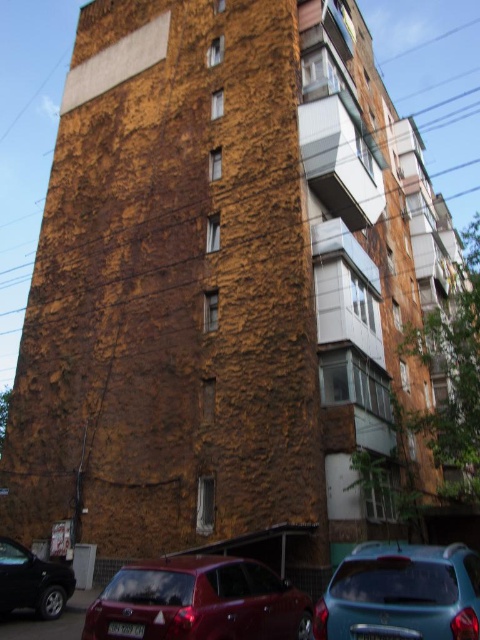
Does shiny red sedan at lower center appear over shiny black car at lower left?

Correct, shiny red sedan at lower center is located above shiny black car at lower left.

Does shiny red sedan at lower center appear under shiny black car at lower left?

Incorrect, shiny red sedan at lower center is not positioned below shiny black car at lower left.

Does point (227, 563) lie behind point (58, 573)?

That is False.

Find the location of `shiny red sedan at lower center`. shiny red sedan at lower center is located at coordinates (199, 602).

Is teal matte car at lower right smaller than shiny black car at lower left?

Correct, teal matte car at lower right occupies less space than shiny black car at lower left.

Does teal matte car at lower right appear on the left side of shiny black car at lower left?

In fact, teal matte car at lower right is to the right of shiny black car at lower left.

Identify the location of teal matte car at lower right. (402, 593).

You are a GUI agent. You are given a task and a screenshot of the screen. Output one action in this format:
    pyautogui.click(x=<x>, y=<y>)
    Task: Click on the teal matte car at lower right
    
    Given the screenshot: What is the action you would take?
    [402, 593]

Does shiny red sedan at lower center have a lesser width compared to teal matte car at lower right?

No, shiny red sedan at lower center is not thinner than teal matte car at lower right.

Is shiny red sedan at lower center wider than teal matte car at lower right?

Yes.

Who is more distant from viewer, (219, 579) or (428, 616)?

The point (219, 579) is behind.

Where is `shiny red sedan at lower center`? The height and width of the screenshot is (640, 480). shiny red sedan at lower center is located at coordinates (199, 602).